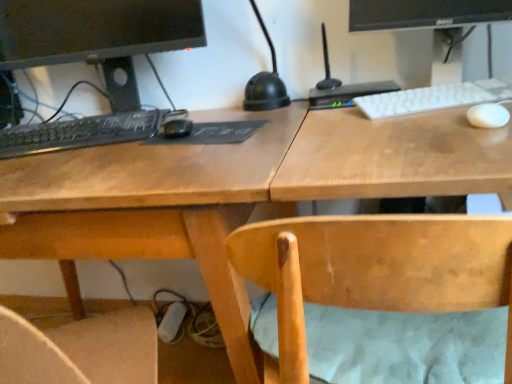
I want to click on free space in front of white matte keyboard at upper right, the 1th computer keyboard in the right-to-left sequence, so click(x=451, y=123).